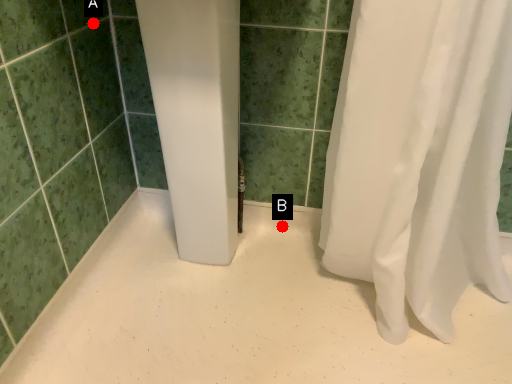
Question: Two points are circled on the image, labeled by A and B beside each circle. Which point is further to the camera?

Choices:
 (A) A is further
 (B) B is further

Answer: (B)